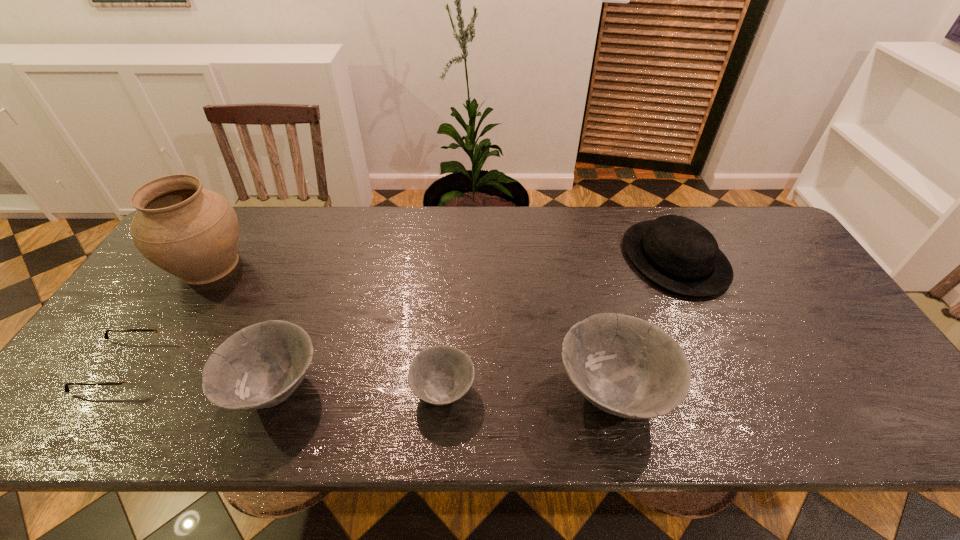
At what (x,y) coordinates should I click in order to perform the action: click on free region located on the left of the rightmost bowl. Please return your answer as a coordinate pair (x, y). The width and height of the screenshot is (960, 540). Looking at the image, I should click on (402, 393).

The width and height of the screenshot is (960, 540). I want to click on vacant position located on the front of the rightmost object, so click(x=735, y=391).

This screenshot has width=960, height=540. I want to click on vacant area located 0.310m on the front of the tallest object, so click(126, 396).

Find the location of a particular element. This screenshot has width=960, height=540. vacant space located at the hinge ends of the shortest object is located at coordinates (276, 366).

Identify the location of fedora present at the far edge. This screenshot has height=540, width=960. (677, 253).

Locate an element on the screen. urn that is at the far edge is located at coordinates (192, 233).

Where is `spectacles situated at the near edge`? Image resolution: width=960 pixels, height=540 pixels. spectacles situated at the near edge is located at coordinates (136, 373).

Image resolution: width=960 pixels, height=540 pixels. I want to click on urn positioned at the left edge, so click(192, 233).

At what (x,y) coordinates should I click in order to perform the action: click on spectacles located in the left edge section of the desktop. Please return your answer as a coordinate pair (x, y). The image size is (960, 540). Looking at the image, I should click on (136, 373).

The image size is (960, 540). Find the location of `object present at the far left corner`. object present at the far left corner is located at coordinates (192, 233).